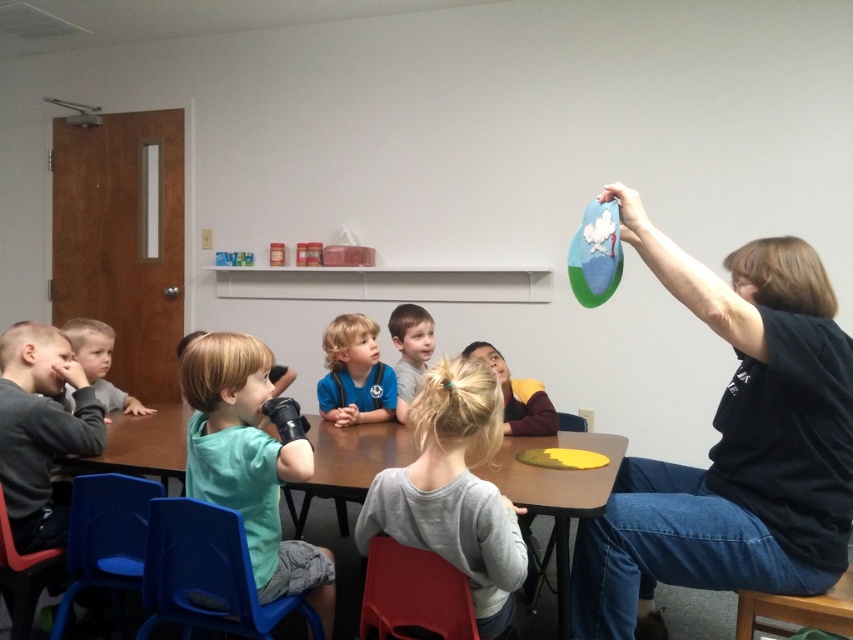
Is point (453, 440) farther from camera compared to point (96, 346)?

No, it is in front of (96, 346).

At what (x,y) coordinates should I click in order to perform the action: click on gray fleece shirt at center. Please return your answer as a coordinate pair (x, y). This screenshot has height=640, width=853. Looking at the image, I should click on (454, 490).

Measure the distance between point (496, 492) and camera.

4.98 feet

This screenshot has width=853, height=640. In order to click on gray fleece shirt at center in this screenshot , I will do point(454,490).

Does brown wooden table at center appear on the left side of light brown hair at center?

Incorrect, brown wooden table at center is not on the left side of light brown hair at center.

Is point (477, 472) farther from viewer compared to point (410, 314)?

No, it is not.

Locate an element on the screen. brown wooden table at center is located at coordinates (556, 493).

Is blue matte shirt at center thinner than light brown hair at center?

No, blue matte shirt at center is not thinner than light brown hair at center.

Measure the distance between point (331, 372) and camera.

The distance of point (331, 372) from camera is 9.34 feet.

Identify the location of blue matte shirt at center. (354, 372).